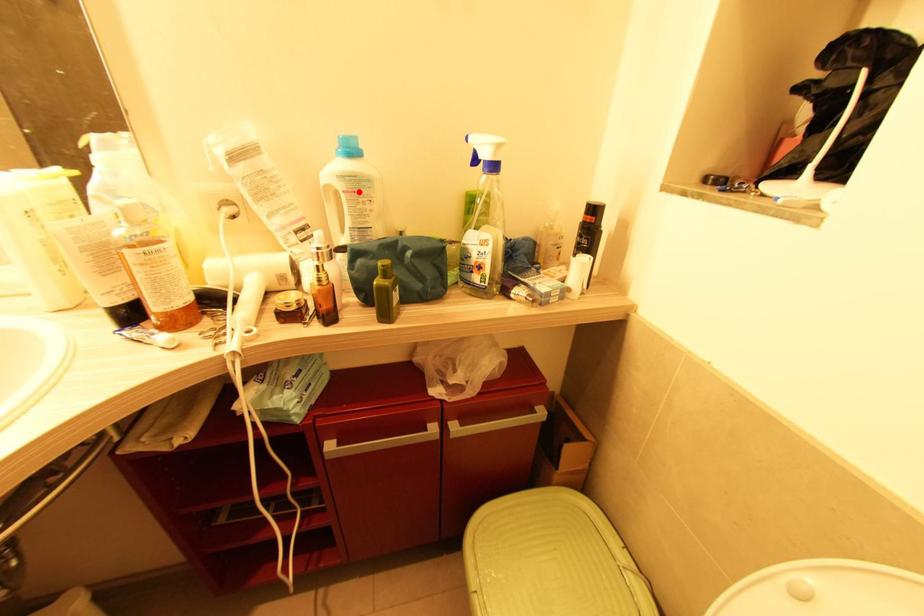
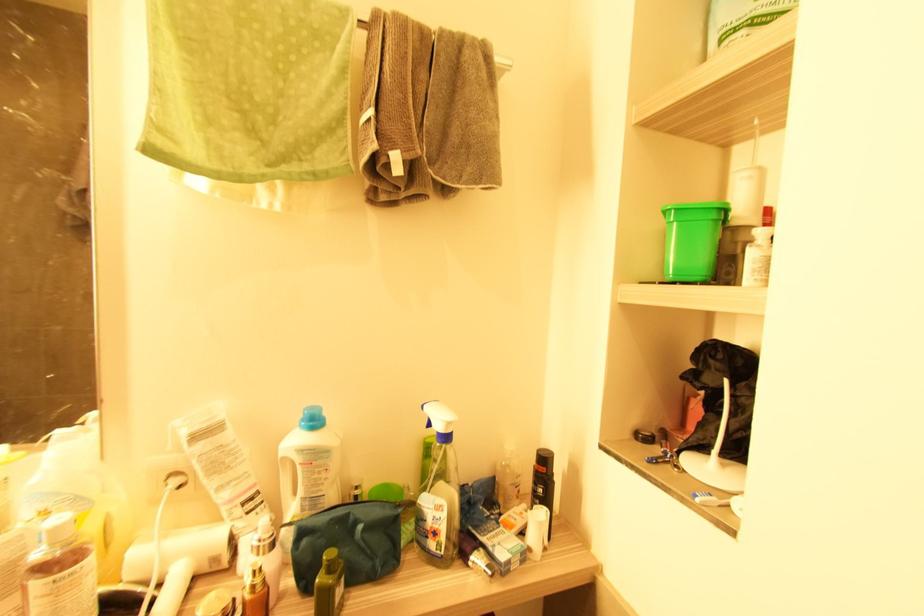
The point at the highlighted location is marked in the first image. Where is the corresponding point in the second image?

(315, 464)